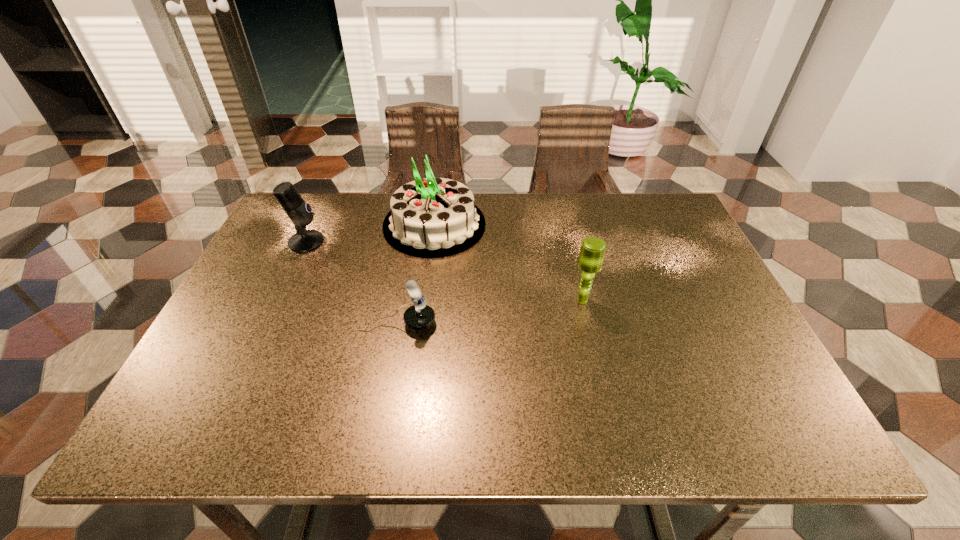
Locate an element on the screen. free space located 0.140m on the right of the shortest object is located at coordinates (495, 323).

The height and width of the screenshot is (540, 960). Find the location of `birthday cake present at the far edge`. birthday cake present at the far edge is located at coordinates (432, 217).

I want to click on microphone located in the far edge section of the desktop, so click(x=300, y=213).

Where is `object at the left edge`? The image size is (960, 540). object at the left edge is located at coordinates (300, 213).

Locate an element on the screen. The image size is (960, 540). object situated at the far left corner is located at coordinates (300, 213).

You are a GUI agent. You are given a task and a screenshot of the screen. Output one action in this format:
    pyautogui.click(x=<x>, y=<y>)
    Task: Click on the free space at the far edge of the desktop
    Image resolution: width=960 pixels, height=540 pixels.
    Given the screenshot: What is the action you would take?
    pyautogui.click(x=382, y=201)

At what (x,y) coordinates should I click in order to perform the action: click on free point at the near edge. Please return your answer as a coordinate pair (x, y). Image resolution: width=960 pixels, height=540 pixels. Looking at the image, I should click on (309, 408).

What are the coordinates of `vacant space at the left edge` in the screenshot? It's located at (273, 244).

Identify the location of vacant area at the right edge of the desktop. This screenshot has width=960, height=540. (722, 376).

Where is `free point at the far left corner`? free point at the far left corner is located at coordinates (281, 218).